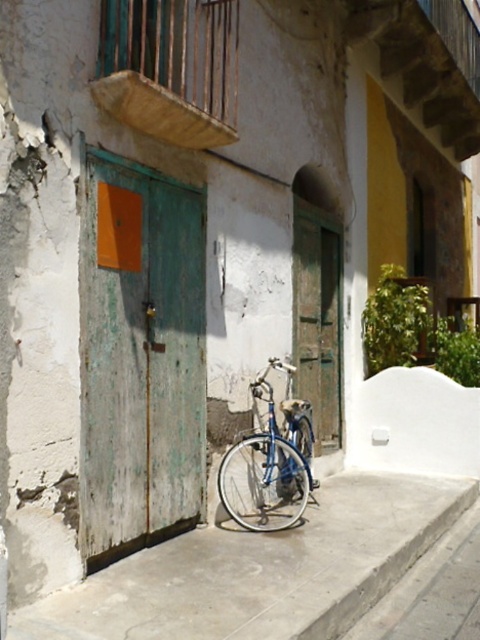
You are a delivery person who needs to park your bike between the two doors. The bike requires a space as wide as the green weathered wood door at center. Is there enough space on the smooth concrete pavement at center for your bike?

The smooth concrete pavement at center is wider than the green weathered wood door at center, so yes, there is enough space for the bike.

You are standing in front of the green weathered wood door at left and want to reach a key hanging on a hook 10 feet away from you. Can you safely walk straight ahead to grab it without needing to move the door?

The distance between you and the green weathered wood door at left is 15.54 feet, so yes, you can safely walk straight ahead to grab the key since the distance to the door is greater than the 10 feet required to reach the key.

You are standing in front of the two doors and want to place a small potted plant exactly halfway between the two points marked as point (271, 596) and point (272, 474). Will the plant be closer to the teal door or the bicycle?

The plant placed halfway between point (271, 596) and point (272, 474) will be closer to the teal door because point (271, 596) is closer to the camera than point (272, 474), meaning the midpoint leans towards the teal door side.